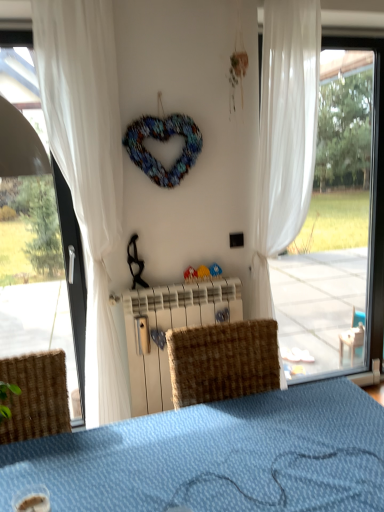
Question: Which direction should I rotate to look at white sheer curtain at center, the first curtain in the right-to-left sequence?

Choices:
 (A) left
 (B) right

Answer: (B)

Question: From a real-world perspective, does white sheer curtain at left, which is the 1th curtain from left to right, stand above white plastic radiator at center?

Choices:
 (A) yes
 (B) no

Answer: (A)

Question: Is white sheer curtain at left, the second curtain when ordered from right to left, thinner than white plastic radiator at center?

Choices:
 (A) no
 (B) yes

Answer: (A)

Question: Would you say white sheer curtain at left, the second curtain when ordered from right to left, is outside white plastic radiator at center?

Choices:
 (A) no
 (B) yes

Answer: (B)

Question: Can you confirm if white sheer curtain at left, the second curtain when ordered from right to left, is positioned to the right of white plastic radiator at center?

Choices:
 (A) no
 (B) yes

Answer: (A)

Question: From a real-world perspective, is white sheer curtain at left, which is the 1th curtain from left to right, physically below white plastic radiator at center?

Choices:
 (A) yes
 (B) no

Answer: (B)

Question: Is the depth of white sheer curtain at left, the second curtain when ordered from right to left, less than that of white plastic radiator at center?

Choices:
 (A) yes
 (B) no

Answer: (A)

Question: From a real-world perspective, is white sheer curtain at center, which is the second curtain in left-to-right order, located higher than translucent plastic cup at lower left?

Choices:
 (A) no
 (B) yes

Answer: (B)

Question: Is white sheer curtain at center, the first curtain in the right-to-left sequence, outside of translucent plastic cup at lower left?

Choices:
 (A) no
 (B) yes

Answer: (B)

Question: Considering the relative positions of white sheer curtain at center, the first curtain in the right-to-left sequence, and translucent plastic cup at lower left in the image provided, is white sheer curtain at center, the first curtain in the right-to-left sequence, to the left of translucent plastic cup at lower left from the viewer's perspective?

Choices:
 (A) yes
 (B) no

Answer: (B)

Question: From the image's perspective, is white sheer curtain at center, which is the second curtain in left-to-right order, above translucent plastic cup at lower left?

Choices:
 (A) yes
 (B) no

Answer: (A)

Question: Can you confirm if white sheer curtain at center, which is the second curtain in left-to-right order, is wider than translucent plastic cup at lower left?

Choices:
 (A) no
 (B) yes

Answer: (B)

Question: Is transparent glass window at right positioned in front of white plastic radiator at center?

Choices:
 (A) yes
 (B) no

Answer: (B)